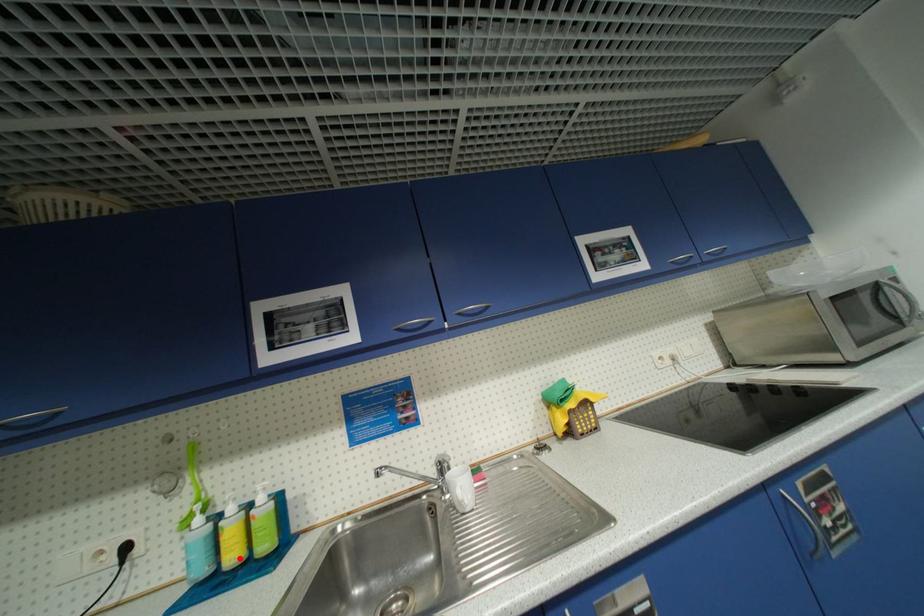
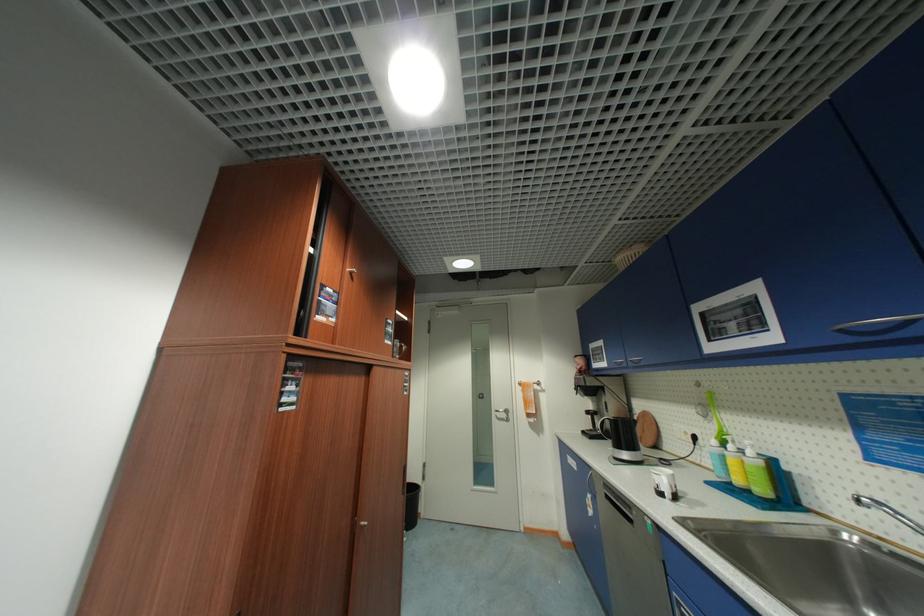
In the second image, find the point that corresponds to the highlighted location in the first image.

(744, 482)